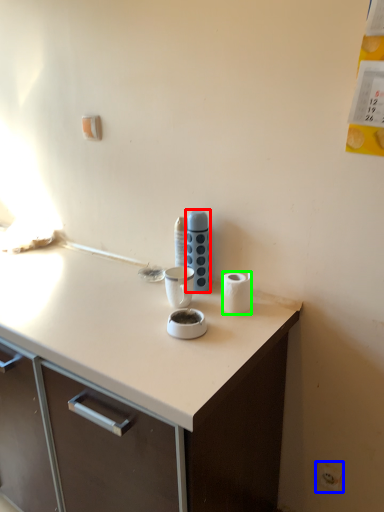
Question: Which object is positioned farthest from appliance (highlighted by a red box)? Select from electric outlet (highlighted by a blue box) and paper towel (highlighted by a green box).

Choices:
 (A) electric outlet
 (B) paper towel

Answer: (A)